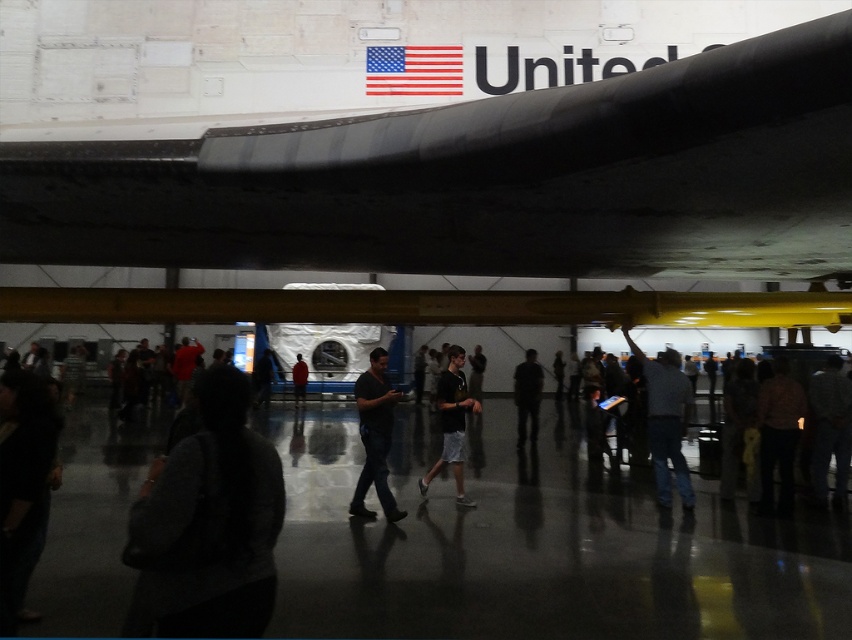
Question: Is the position of matte black airplane at center less distant than that of dark gray sweater at lower left?

Choices:
 (A) no
 (B) yes

Answer: (B)

Question: Based on their relative distances, which object is nearer to the dark gray fabric jacket at center?

Choices:
 (A) red shirt at center
 (B) red fabric flag at upper center
 (C) matte black airplane at center
 (D) dark gray sweater at lower left

Answer: (A)

Question: Which object is farther from the camera taking this photo?

Choices:
 (A) red shirt at center
 (B) dark gray sweater at lower left
 (C) dark gray fabric jacket at center

Answer: (A)

Question: Considering the relative positions of dark gray sweater at lower left and dark gray fabric jacket at center in the image provided, where is dark gray sweater at lower left located with respect to dark gray fabric jacket at center?

Choices:
 (A) left
 (B) right

Answer: (A)

Question: Estimate the real-world distances between objects in this image. Which object is closer to the red fabric flag at upper center?

Choices:
 (A) matte black airplane at center
 (B) red shirt at center
 (C) dark gray fabric jacket at center

Answer: (A)

Question: Is dark gray shorts at center positioned at the back of dark gray fabric jacket at center?

Choices:
 (A) yes
 (B) no

Answer: (B)